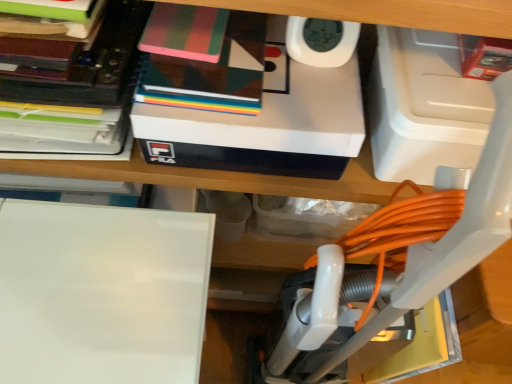
Where is `free space to the right of geometric-patterned notebook at upper center, which is the 2th book in left-to-right order`? Image resolution: width=512 pixels, height=384 pixels. free space to the right of geometric-patterned notebook at upper center, which is the 2th book in left-to-right order is located at coordinates (300, 89).